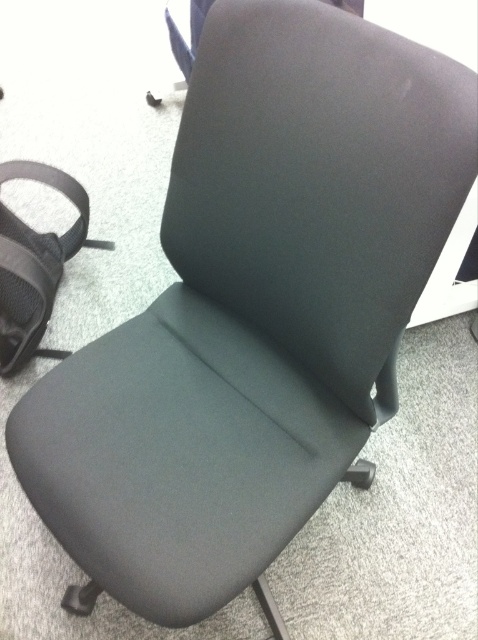
Question: From the image, what is the correct spatial relationship of dark gray fabric chair at center in relation to black mesh strap at left?

Choices:
 (A) left
 (B) right

Answer: (B)

Question: Can you confirm if dark gray fabric chair at center is bigger than black mesh strap at left?

Choices:
 (A) no
 (B) yes

Answer: (B)

Question: Which point appears closest to the camera in this image?

Choices:
 (A) (73, 204)
 (B) (347, 148)

Answer: (B)

Question: Which point is closer to the camera?

Choices:
 (A) (3, 260)
 (B) (300, 285)

Answer: (B)

Question: Can you confirm if dark gray fabric chair at center is positioned below black mesh strap at left?

Choices:
 (A) no
 (B) yes

Answer: (B)